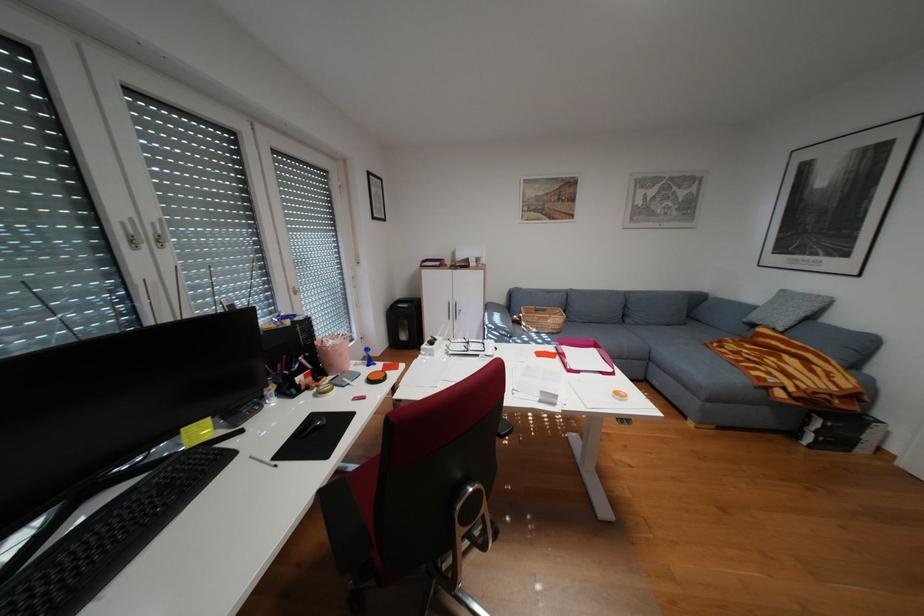
Find where to resting arm the black chair armrest. Please return your answer as a coordinate pair (x, y).

(337, 519)